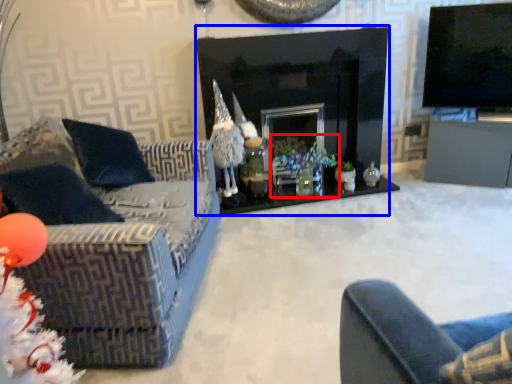
Question: Which point is further to the camera, christmas decoration (highlighted by a red box) or fireplace (highlighted by a blue box)?

Choices:
 (A) christmas decoration
 (B) fireplace

Answer: (A)